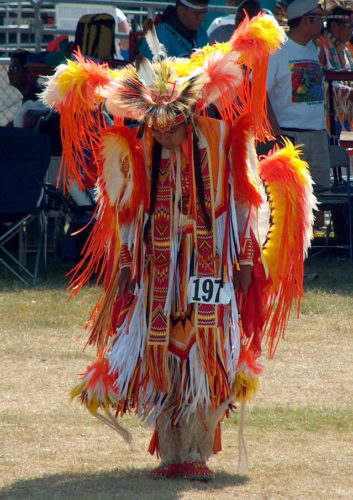
Identify the location of chair. The image size is (353, 500). (19, 162), (341, 196).